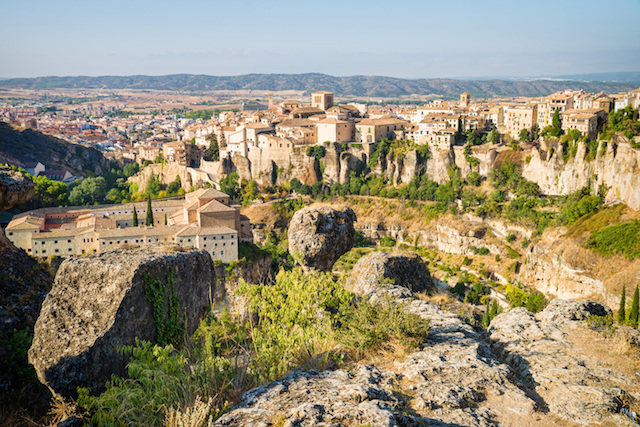
Locate an element on the screen. windows is located at coordinates (68, 216), (61, 216), (45, 241), (56, 242), (198, 241), (219, 242), (17, 233).